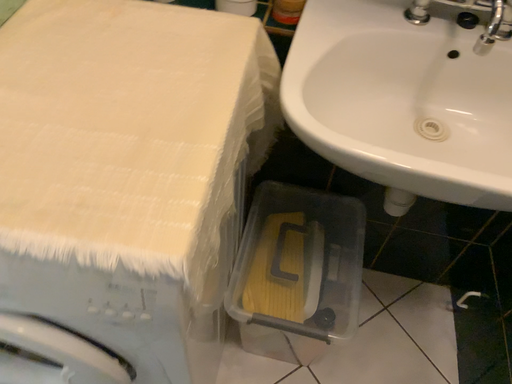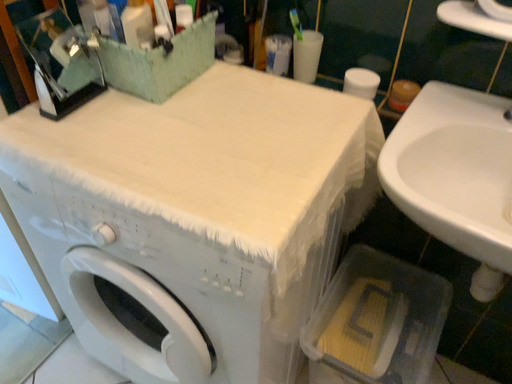
Question: Which way did the camera rotate in the video?

Choices:
 (A) rotated upward
 (B) rotated downward

Answer: (A)